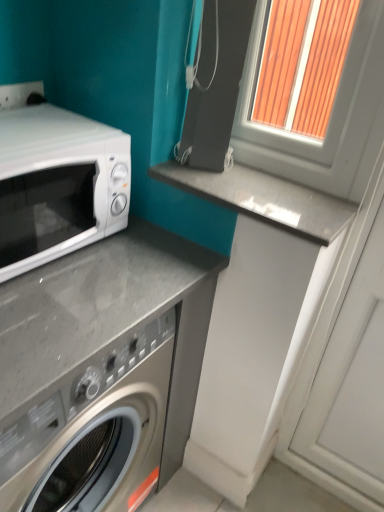
Question: From a real-world perspective, is white plastic window frame at upper right over gray polished stone counter top at center?

Choices:
 (A) yes
 (B) no

Answer: (A)

Question: Does white plastic window frame at upper right have a smaller size compared to gray polished stone counter top at center?

Choices:
 (A) yes
 (B) no

Answer: (B)

Question: From the image's perspective, is white plastic window frame at upper right located above gray polished stone counter top at center?

Choices:
 (A) no
 (B) yes

Answer: (B)

Question: Are white plastic window frame at upper right and gray polished stone counter top at center far apart?

Choices:
 (A) yes
 (B) no

Answer: (B)

Question: Is white plastic window frame at upper right oriented towards gray polished stone counter top at center?

Choices:
 (A) no
 (B) yes

Answer: (B)

Question: Is white plastic window frame at upper right to the right of gray polished stone counter top at center from the viewer's perspective?

Choices:
 (A) yes
 (B) no

Answer: (A)

Question: Does white plastic window frame at upper right have a smaller size compared to white glossy microwave at left?

Choices:
 (A) yes
 (B) no

Answer: (B)

Question: Is white plastic window frame at upper right closer to the viewer compared to white glossy microwave at left?

Choices:
 (A) yes
 (B) no

Answer: (B)

Question: From a real-world perspective, is white plastic window frame at upper right located higher than white glossy microwave at left?

Choices:
 (A) no
 (B) yes

Answer: (B)

Question: Is white plastic window frame at upper right at the right side of white glossy microwave at left?

Choices:
 (A) no
 (B) yes

Answer: (B)

Question: Does white plastic window frame at upper right contain white glossy microwave at left?

Choices:
 (A) yes
 (B) no

Answer: (B)

Question: Does white plastic window frame at upper right have a greater height compared to white glossy microwave at left?

Choices:
 (A) no
 (B) yes

Answer: (B)

Question: From a real-world perspective, is gray polished stone counter top at center located higher than white glossy microwave at left?

Choices:
 (A) yes
 (B) no

Answer: (A)